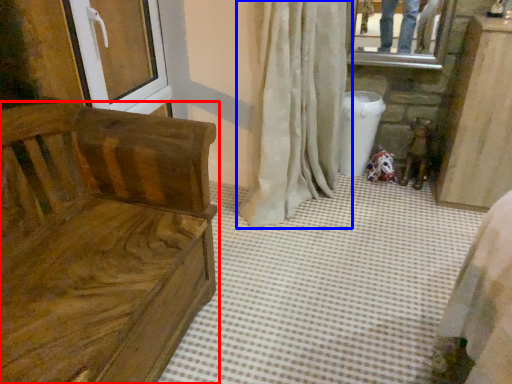
Question: Among these objects, which one is nearest to the camera, furniture (highlighted by a red box) or curtain (highlighted by a blue box)?

Choices:
 (A) furniture
 (B) curtain

Answer: (A)